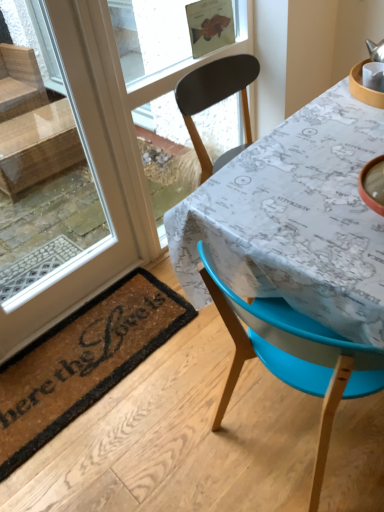
Image resolution: width=384 pixels, height=512 pixels. What do you see at coordinates (83, 361) in the screenshot? I see `brown coir mat at lower left` at bounding box center [83, 361].

Where is `map-patterned fabric at center`? Image resolution: width=384 pixels, height=512 pixels. map-patterned fabric at center is located at coordinates (295, 219).

What do you see at coordinates (293, 356) in the screenshot? The image size is (384, 512). I see `blue plastic chair at lower right` at bounding box center [293, 356].

In order to face transparent glass window screen at upper center, should I rotate leftwards or rightwards?

Turn left approximately 2.102 degrees to face it.

Find the location of a particular element. brown coir mat at lower left is located at coordinates (83, 361).

Which of these two, blue plastic chair at lower right or brown coir mat at lower left, stands taller?

blue plastic chair at lower right is taller.

From a real-world perspective, is blue plastic chair at lower right on brown coir mat at lower left?

Indeed, from a real-world perspective, blue plastic chair at lower right stands above brown coir mat at lower left.

From the image's perspective, is blue plastic chair at lower right above brown coir mat at lower left?

Correct, blue plastic chair at lower right appears higher than brown coir mat at lower left in the image.

In the scene shown: Is blue plastic chair at lower right facing towards brown coir mat at lower left?

No, blue plastic chair at lower right is not aimed at brown coir mat at lower left.

Considering the positions of point (121, 369) and point (247, 288), is point (121, 369) closer or farther from the camera than point (247, 288)?

Point (121, 369) appears to be farther away from the viewer than point (247, 288).

From the image's perspective, between brown coir mat at lower left and map-patterned fabric at center, who is located below?

brown coir mat at lower left appears lower in the image.

Considering the sizes of brown coir mat at lower left and map-patterned fabric at center in the image, is brown coir mat at lower left taller or shorter than map-patterned fabric at center?

brown coir mat at lower left is shorter than map-patterned fabric at center.

Is brown coir mat at lower left oriented towards map-patterned fabric at center?

No, brown coir mat at lower left is not aimed at map-patterned fabric at center.

Based on the photo, can you confirm if blue plastic chair at lower right is wider than map-patterned fabric at center?

Incorrect, the width of blue plastic chair at lower right does not surpass that of map-patterned fabric at center.

Between blue plastic chair at lower right and map-patterned fabric at center, which one has more height?

Standing taller between the two is blue plastic chair at lower right.

From the image's perspective, which one is positioned higher, blue plastic chair at lower right or map-patterned fabric at center?

map-patterned fabric at center, from the image's perspective.

From a real-world perspective, relative to map-patterned fabric at center, is blue plastic chair at lower right vertically above or below?

From a real-world perspective, blue plastic chair at lower right is physically above map-patterned fabric at center.

Is map-patterned fabric at center taller than transparent glass window at upper left?

No.

From a real-world perspective, is map-patterned fabric at center beneath transparent glass window at upper left?

Yes, from a real-world perspective, map-patterned fabric at center is under transparent glass window at upper left.

Is transparent glass window at upper left surrounded by map-patterned fabric at center?

No, transparent glass window at upper left is not surrounded by map-patterned fabric at center.

Could you tell me if map-patterned fabric at center is facing transparent glass window at upper left?

No.

Which object is positioned more to the right, transparent glass window at upper left or transparent glass window screen at upper center?

Positioned to the right is transparent glass window screen at upper center.

Considering the relative sizes of transparent glass window at upper left and transparent glass window screen at upper center in the image provided, is transparent glass window at upper left thinner than transparent glass window screen at upper center?

Correct, the width of transparent glass window at upper left is less than that of transparent glass window screen at upper center.

How distant is transparent glass window at upper left from transparent glass window screen at upper center?

transparent glass window at upper left is 27.92 inches from transparent glass window screen at upper center.

Considering the points (145, 237) and (150, 6), which point is in front, point (145, 237) or point (150, 6)?

Point (145, 237)

Can you confirm if map-patterned fabric at center is bigger than blue plastic chair at lower right?

Yes.

Which object is wider, map-patterned fabric at center or blue plastic chair at lower right?

map-patterned fabric at center is wider.

Is map-patterned fabric at center spatially inside blue plastic chair at lower right, or outside of it?

The correct answer is: outside.

Which object is closer to the camera taking this photo, map-patterned fabric at center or blue plastic chair at lower right?

blue plastic chair at lower right.

Which is in front, brown coir mat at lower left or blue plastic chair at lower right?

Positioned in front is blue plastic chair at lower right.

Is brown coir mat at lower left facing towards blue plastic chair at lower right?

No.

Which of these two, brown coir mat at lower left or blue plastic chair at lower right, stands taller?

blue plastic chair at lower right is taller.

From the image's perspective, does brown coir mat at lower left appear lower than blue plastic chair at lower right?

Yes, from the image's perspective, brown coir mat at lower left is beneath blue plastic chair at lower right.

Locate an element on the screen. The height and width of the screenshot is (512, 384). chair lying in front of the brown coir mat at lower left is located at coordinates (293, 356).

Identify the location of table located on the right of brown coir mat at lower left. (295, 219).

From the image, which object appears to be nearer to map-patterned fabric at center, brown coir mat at lower left or transparent glass window screen at upper center?

The object closer to map-patterned fabric at center is brown coir mat at lower left.

Which object lies further to the anchor point transparent glass window at upper left, transparent glass window screen at upper center or blue plastic chair at lower right?

blue plastic chair at lower right is further to transparent glass window at upper left.

From the image, which object appears to be nearer to transparent glass window at upper left, blue plastic chair at lower right or brown coir mat at lower left?

brown coir mat at lower left lies closer to transparent glass window at upper left than the other object.

From the picture: From the image, which object appears to be farther from brown coir mat at lower left, blue plastic chair at lower right or transparent glass window screen at upper center?

The object further to brown coir mat at lower left is transparent glass window screen at upper center.

From the picture: Looking at the image, which one is located closer to transparent glass window at upper left, brown coir mat at lower left or map-patterned fabric at center?

Based on the image, brown coir mat at lower left appears to be nearer to transparent glass window at upper left.

From the picture: Estimate the real-world distances between objects in this image. Which object is closer to transparent glass window at upper left, brown coir mat at lower left or blue plastic chair at lower right?

Based on the image, brown coir mat at lower left appears to be nearer to transparent glass window at upper left.

Considering their positions, is transparent glass window at upper left positioned further to brown coir mat at lower left than transparent glass window screen at upper center?

transparent glass window screen at upper center.

Which object lies nearer to the anchor point transparent glass window screen at upper center, blue plastic chair at lower right or map-patterned fabric at center?

map-patterned fabric at center is closer to transparent glass window screen at upper center.

In order to click on window between transparent glass window screen at upper center and blue plastic chair at lower right in the vertical direction in this screenshot , I will do `click(98, 165)`.

Identify the location of chair between transparent glass window at upper left and brown coir mat at lower left in the vertical direction. The width and height of the screenshot is (384, 512). (293, 356).

Locate an element on the screen. window that lies between transparent glass window screen at upper center and brown coir mat at lower left from top to bottom is located at coordinates click(98, 165).

Locate an element on the screen. The height and width of the screenshot is (512, 384). chair between brown coir mat at lower left and map-patterned fabric at center in the horizontal direction is located at coordinates (293, 356).